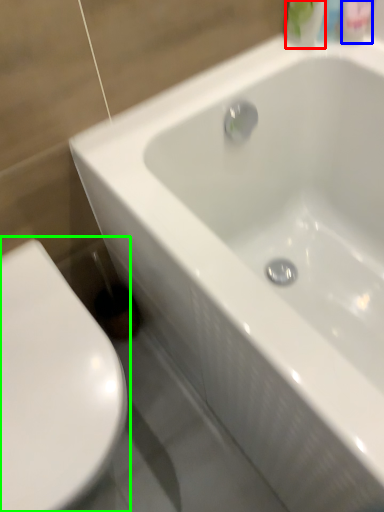
Question: Which is farther away from mouthwash (highlighted by a red box)? mouthwash (highlighted by a blue box) or toilet (highlighted by a green box)?

Choices:
 (A) mouthwash
 (B) toilet

Answer: (B)